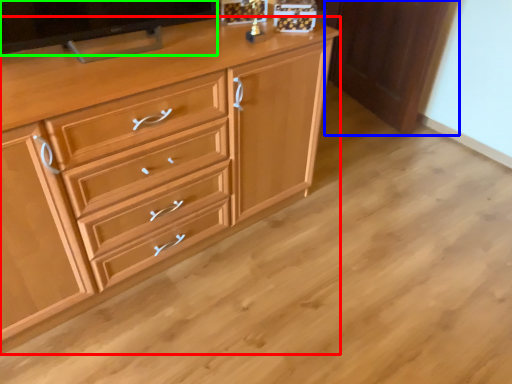
Question: Which is farther away from chest of drawers (highlighted by a red box)? cabinetry (highlighted by a blue box) or television (highlighted by a green box)?

Choices:
 (A) cabinetry
 (B) television

Answer: (A)